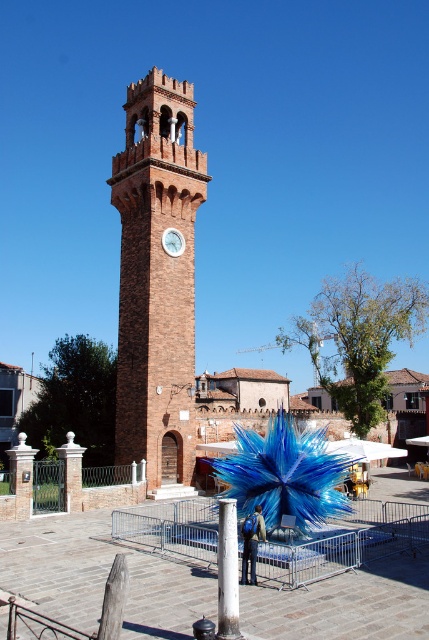
Question: Which of the following is the farthest from the observer?

Choices:
 (A) white glossy clock at center
 (B) brick clock tower at center
 (C) white painted metal pole at center

Answer: (A)

Question: Which point is closer to the camera taking this photo?

Choices:
 (A) (162, 237)
 (B) (229, 550)

Answer: (B)

Question: Can you confirm if brick clock tower at center is wider than white glossy clock at center?

Choices:
 (A) yes
 (B) no

Answer: (A)

Question: Can you confirm if brick clock tower at center is positioned to the left of white painted metal pole at center?

Choices:
 (A) yes
 (B) no

Answer: (A)

Question: Considering the real-world distances, which object is farthest from the white painted metal pole at center?

Choices:
 (A) brick clock tower at center
 (B) white glossy clock at center

Answer: (A)

Question: Considering the relative positions of white painted metal pole at center and white glossy clock at center in the image provided, where is white painted metal pole at center located with respect to white glossy clock at center?

Choices:
 (A) above
 (B) below

Answer: (B)